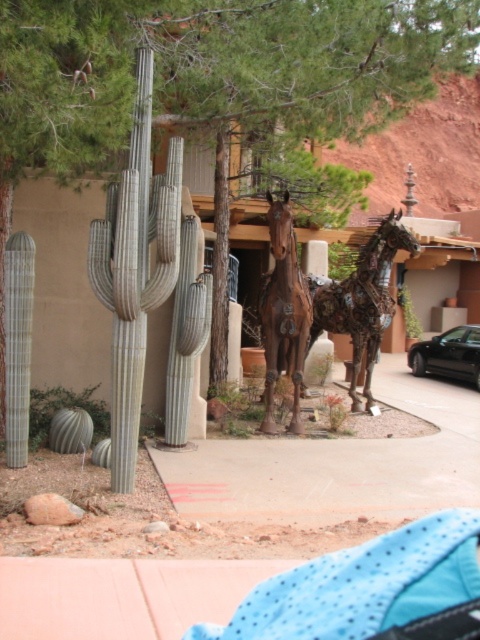
Question: Considering the relative positions of greenish-gray textured cactus at left and brown matte horse at center in the image provided, where is greenish-gray textured cactus at left located with respect to brown matte horse at center?

Choices:
 (A) left
 (B) right

Answer: (A)

Question: Considering the relative positions of greenish-gray textured cactus at left and black metallic car at center in the image provided, where is greenish-gray textured cactus at left located with respect to black metallic car at center?

Choices:
 (A) below
 (B) above

Answer: (B)

Question: Which of the following is the farthest from the observer?

Choices:
 (A) pos(420,340)
 (B) pos(331,324)
 (C) pos(278,280)

Answer: (A)

Question: Estimate the real-world distances between objects in this image. Which object is farther from the black metallic car at center?

Choices:
 (A) metallic horse at center
 (B) brown matte horse at center

Answer: (B)

Question: Can you confirm if greenish-gray textured cactus at left is thinner than brown matte horse at center?

Choices:
 (A) no
 (B) yes

Answer: (A)

Question: Among these objects, which one is nearest to the camera?

Choices:
 (A) black metallic car at center
 (B) metallic horse at center
 (C) greenish-gray textured cactus at left
 (D) brown matte horse at center

Answer: (C)